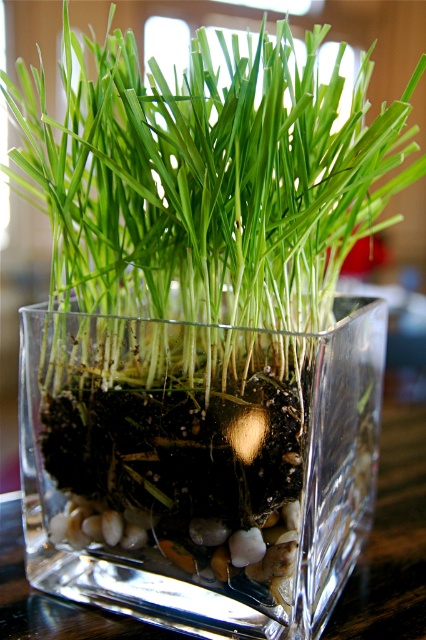
Question: Can you confirm if transparent glass cube at center is bigger than green matte grass at center?

Choices:
 (A) no
 (B) yes

Answer: (A)

Question: Is the position of transparent glass cube at center less distant than that of green matte grass at center?

Choices:
 (A) yes
 (B) no

Answer: (B)

Question: Which of the following is the farthest from the observer?

Choices:
 (A) green matte grass at center
 (B) transparent glass cube at center

Answer: (B)

Question: Which point is closer to the camera?

Choices:
 (A) green matte grass at center
 (B) transparent glass cube at center

Answer: (A)

Question: Is transparent glass cube at center bigger than green matte grass at center?

Choices:
 (A) no
 (B) yes

Answer: (A)